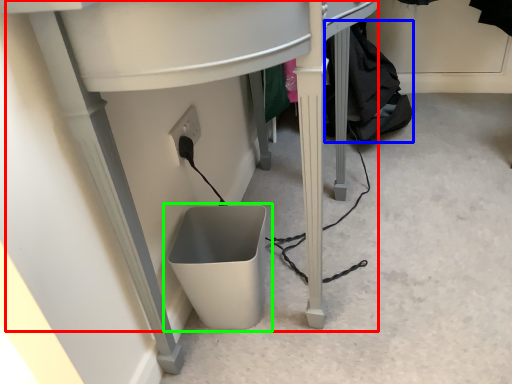
Question: Which object is positioned farthest from computer desk (highlighted by a red box)? Select from clothing (highlighted by a blue box) and waste container (highlighted by a green box).

Choices:
 (A) clothing
 (B) waste container

Answer: (A)